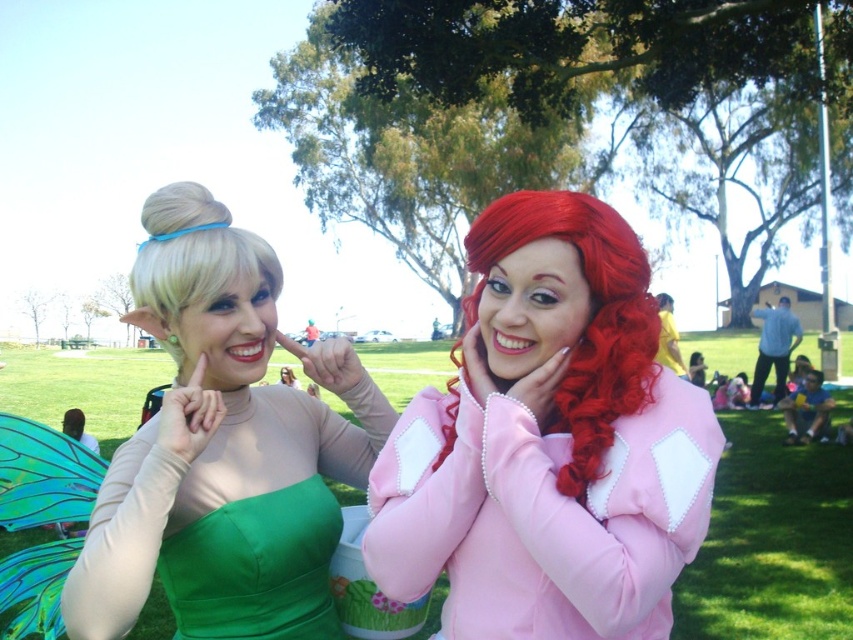
Is green satin dress at left to the left of blonde silky hair at upper left from the viewer's perspective?

Incorrect, green satin dress at left is not on the left side of blonde silky hair at upper left.

Is point (184, 582) more distant than point (173, 248)?

No, (184, 582) is closer to viewer.

Does point (190, 180) lie in front of point (157, 276)?

No, (190, 180) is behind (157, 276).

The image size is (853, 640). Identify the location of green satin dress at left. (223, 449).

Is green satin dress at left bigger than green satin dress at center?

Indeed, green satin dress at left has a larger size compared to green satin dress at center.

Can you confirm if green satin dress at left is taller than green satin dress at center?

A: Yes, green satin dress at left is taller than green satin dress at center.

Describe the element at coordinates (223, 449) in the screenshot. I see `green satin dress at left` at that location.

This screenshot has width=853, height=640. Find the location of `green satin dress at left`. green satin dress at left is located at coordinates (223, 449).

Is green satin dress at left above curly matte red hair at center?

Actually, green satin dress at left is below curly matte red hair at center.

Between point (172, 502) and point (569, 417), which one is positioned behind?

Positioned behind is point (172, 502).

Does point (177, 612) come in front of point (614, 336)?

That is False.

Locate an element on the screen. green satin dress at left is located at coordinates (223, 449).